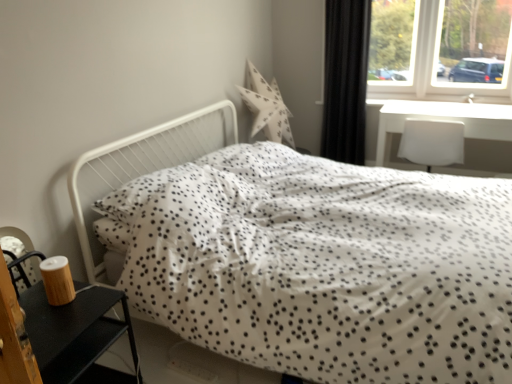
Locate an element on the screen. transparent glass window at upper right is located at coordinates (435, 66).

The image size is (512, 384). Describe the element at coordinates (57, 280) in the screenshot. I see `wooden candle holder at lower left` at that location.

This screenshot has width=512, height=384. Find the location of `black fabric curtain at upper right`. black fabric curtain at upper right is located at coordinates tap(345, 79).

This screenshot has width=512, height=384. Identify the location of white plastic chair at right. (414, 97).

Measure the distance between white dotted fabric bed at center and camera.

white dotted fabric bed at center and camera are 4.11 feet apart.

Locate an element on the screen. white plastic chair at right is located at coordinates (445, 119).

Is white plastic chair at right behind wooden nightstand at lower left?

Yes, it is behind wooden nightstand at lower left.

From the image's perspective, which is above, white plastic chair at right or wooden nightstand at lower left?

white plastic chair at right appears higher in the image.

Considering the positions of objects white plastic chair at right and wooden nightstand at lower left in the image provided, who is more to the right, white plastic chair at right or wooden nightstand at lower left?

Positioned to the right is white plastic chair at right.

Could you tell me if white plastic chair at right is turned towards wooden nightstand at lower left?

No, white plastic chair at right is not facing towards wooden nightstand at lower left.

Does wooden nightstand at lower left have a lesser width compared to white plastic chair at right?

Indeed, wooden nightstand at lower left has a lesser width compared to white plastic chair at right.

Does point (38, 329) come behind point (380, 158)?

No, it is not.

How many degrees apart are the facing directions of wooden nightstand at lower left and white plastic chair at right?

92.2 degrees.

Can we say wooden nightstand at lower left lies outside white plastic chair at right?

Absolutely, wooden nightstand at lower left is external to white plastic chair at right.

Which is more to the right, white dotted fabric bed at center or wooden candle holder at lower left?

white dotted fabric bed at center is more to the right.

Would you say white dotted fabric bed at center is a long distance from wooden candle holder at lower left?

Answer: That's not correct — white dotted fabric bed at center is a little close to wooden candle holder at lower left.

Is white dotted fabric bed at center positioned beyond the bounds of wooden candle holder at lower left?

Yes, white dotted fabric bed at center is outside of wooden candle holder at lower left.

From the image's perspective, relative to wooden candle holder at lower left, is white dotted fabric bed at center above or below?

Clearly, from the image's perspective, white dotted fabric bed at center is above wooden candle holder at lower left.

Which point is more forward, (335, 142) or (75, 335)?

The point (75, 335) is in front.

Considering the relative sizes of black fabric curtain at upper right and wooden nightstand at lower left in the image provided, is black fabric curtain at upper right wider than wooden nightstand at lower left?

No.

This screenshot has height=384, width=512. In order to click on curtain above the wooden nightstand at lower left (from a real-world perspective) in this screenshot , I will do coord(345,79).

Considering the relative sizes of wooden nightstand at lower left and transparent glass window at upper right in the image provided, is wooden nightstand at lower left taller than transparent glass window at upper right?

No, wooden nightstand at lower left is not taller than transparent glass window at upper right.

From a real-world perspective, which object rests below the other?

wooden nightstand at lower left is physically lower.

Who is more distant, wooden nightstand at lower left or transparent glass window at upper right?

transparent glass window at upper right is further from the camera.

Is wooden nightstand at lower left turned away from transparent glass window at upper right?

No, wooden nightstand at lower left is not facing the opposite direction of transparent glass window at upper right.

Is wooden nightstand at lower left beside white dotted fabric bed at center?

No, wooden nightstand at lower left is not beside white dotted fabric bed at center.

Does wooden nightstand at lower left have a larger size compared to white dotted fabric bed at center?

No, wooden nightstand at lower left is not bigger than white dotted fabric bed at center.

Could you tell me if wooden nightstand at lower left is facing white dotted fabric bed at center?

No, wooden nightstand at lower left is not facing towards white dotted fabric bed at center.

Is white plastic chair at right taller or shorter than transparent glass window at upper right?

Clearly, white plastic chair at right is shorter compared to transparent glass window at upper right.

Looking at this image, from the image's perspective, which is below, white plastic chair at right or transparent glass window at upper right?

From the image's view, white plastic chair at right is below.

Is white plastic chair at right situated inside transparent glass window at upper right or outside?

white plastic chair at right is not inside transparent glass window at upper right, it's outside.

From a real-world perspective, relative to transparent glass window at upper right, is white plastic chair at right vertically above or below?

white plastic chair at right is below transparent glass window at upper right.

Locate an element on the screen. The width and height of the screenshot is (512, 384). nightstand below the white plastic chair at right (from a real-world perspective) is located at coordinates (60, 336).

Identify the location of table above the wooden nightstand at lower left (from the image's perspective). This screenshot has height=384, width=512. (445, 119).

Estimate the real-world distances between objects in this image. Which object is closer to transparent glass window at upper right, white plastic chair at right or black fabric curtain at upper right?

white plastic chair at right lies closer to transparent glass window at upper right than the other object.

From the image, which object appears to be farther from white plastic chair at right, white plastic chair at right or wooden candle holder at lower left?

wooden candle holder at lower left is further to white plastic chair at right.

From the picture: Looking at the image, which one is located closer to white dotted fabric bed at center, wooden candle holder at lower left or black fabric curtain at upper right?

Based on the image, wooden candle holder at lower left appears to be nearer to white dotted fabric bed at center.

Considering their positions, is white plastic chair at right positioned further to white plastic chair at right than black fabric curtain at upper right?

black fabric curtain at upper right is positioned further to the anchor white plastic chair at right.

Based on their spatial positions, is white dotted fabric bed at center or white plastic chair at right closer to wooden candle holder at lower left?

Based on the image, white dotted fabric bed at center appears to be nearer to wooden candle holder at lower left.

Which object lies nearer to the anchor point black fabric curtain at upper right, white plastic chair at right or wooden nightstand at lower left?

The object closer to black fabric curtain at upper right is white plastic chair at right.

Estimate the real-world distances between objects in this image. Which object is further from white plastic chair at right, white dotted fabric bed at center or wooden nightstand at lower left?

wooden nightstand at lower left is positioned further to the anchor white plastic chair at right.

Based on their spatial positions, is wooden candle holder at lower left or transparent glass window at upper right closer to white dotted fabric bed at center?

wooden candle holder at lower left.

What are the coordinates of `candle holder between wooden nightstand at lower left and white plastic chair at right` in the screenshot? It's located at (57, 280).

Where is `candle holder between wooden nightstand at lower left and black fabric curtain at upper right in the front-back direction`? The width and height of the screenshot is (512, 384). candle holder between wooden nightstand at lower left and black fabric curtain at upper right in the front-back direction is located at coordinates click(x=57, y=280).

At what (x,y) coordinates should I click in order to perform the action: click on window sill between wooden nightstand at lower left and transparent glass window at upper right in the horizontal direction. Please return your answer as a coordinate pair (x, y). The height and width of the screenshot is (384, 512). Looking at the image, I should click on (414, 97).

This screenshot has height=384, width=512. I want to click on table located between wooden candle holder at lower left and transparent glass window at upper right in the left-right direction, so click(445, 119).